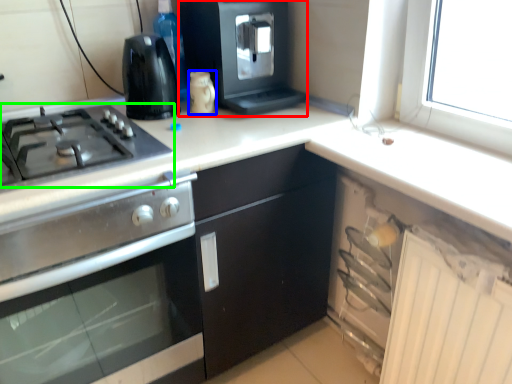
Question: Based on their relative distances, which object is nearer to kitchen appliance (highlighted by a red box)? Choose from kitchen appliance (highlighted by a blue box) and gas stove (highlighted by a green box).

Choices:
 (A) kitchen appliance
 (B) gas stove

Answer: (A)